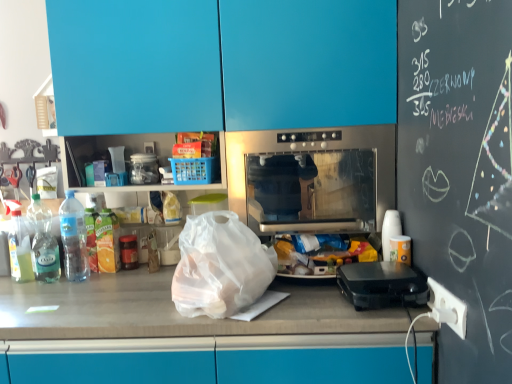
Describe the element at coordinates (20, 249) in the screenshot. This screenshot has height=384, width=512. I see `clear plastic bottle at left, the first bottle in the left-to-right sequence` at that location.

In order to face blue glossy cabinets at upper center, should I rotate leftwards or rightwards?

To align with it, rotate left about 3.722°.

This screenshot has width=512, height=384. Describe the element at coordinates (135, 65) in the screenshot. I see `blue glossy cabinets at upper center` at that location.

I want to click on clear plastic bottle at left, acting as the 2th bottle starting from the left, so click(x=42, y=242).

Is stainless steel oven at center not near clear plastic bottle at left, the 2th bottle when ordered from right to left?

No, there isn't a large distance between stainless steel oven at center and clear plastic bottle at left, the 2th bottle when ordered from right to left.

From the image's perspective, relative to clear plastic bottle at left, the 2th bottle when ordered from right to left, is stainless steel oven at center above or below?

Based on their image positions, stainless steel oven at center is located above clear plastic bottle at left, the 2th bottle when ordered from right to left.

Considering the sizes of stainless steel oven at center and clear plastic bottle at left, acting as the 2th bottle starting from the left, in the image, is stainless steel oven at center bigger or smaller than clear plastic bottle at left, acting as the 2th bottle starting from the left,?

stainless steel oven at center is bigger than clear plastic bottle at left, acting as the 2th bottle starting from the left.

From their relative heights in the image, would you say stainless steel oven at center is taller or shorter than clear plastic bottle at left, the 2th bottle when ordered from right to left?

Clearly, stainless steel oven at center is taller compared to clear plastic bottle at left, the 2th bottle when ordered from right to left.

Which of these two, clear plastic bottle at left, acting as the 3th bottle starting from the right, or translucent plastic bag at center, stands shorter?

With less height is clear plastic bottle at left, acting as the 3th bottle starting from the right.

From a real-world perspective, is clear plastic bottle at left, the first bottle in the left-to-right sequence, positioned above or below translucent plastic bag at center?

clear plastic bottle at left, the first bottle in the left-to-right sequence, is situated lower than translucent plastic bag at center in the real world.

Identify the location of plastic bag located in front of the clear plastic bottle at left, acting as the 3th bottle starting from the right. The image size is (512, 384). (220, 266).

Is clear plastic bottle at left, acting as the 3th bottle starting from the right, aimed at translucent plastic bag at center?

No, clear plastic bottle at left, acting as the 3th bottle starting from the right, is not oriented towards translucent plastic bag at center.

Locate an element on the screen. home appliance located on the right of clear plastic bottle at left, acting as the 2th bottle starting from the left is located at coordinates (312, 178).

Considering the sizes of objects clear plastic bottle at left, acting as the 2th bottle starting from the left, and stainless steel oven at center in the image provided, who is wider, clear plastic bottle at left, acting as the 2th bottle starting from the left, or stainless steel oven at center?

With larger width is stainless steel oven at center.

Do you think clear plastic bottle at left, acting as the 2th bottle starting from the left, is within stainless steel oven at center, or outside of it?

clear plastic bottle at left, acting as the 2th bottle starting from the left, is not enclosed by stainless steel oven at center.

Which object is more forward, clear plastic bottle at left, the 2th bottle when ordered from right to left, or stainless steel oven at center?

stainless steel oven at center is in front.

Measure the distance between clear plastic bottle at left, the 2th bottle when ordered from right to left, and black plastic waffle maker at right.

They are 3.78 feet apart.

How different are the orientations of clear plastic bottle at left, the 2th bottle when ordered from right to left, and black plastic waffle maker at right in degrees?

0.000536 degrees.

Where is `appliance below the clear plastic bottle at left, acting as the 2th bottle starting from the left (from a real-world perspective)`? Image resolution: width=512 pixels, height=384 pixels. appliance below the clear plastic bottle at left, acting as the 2th bottle starting from the left (from a real-world perspective) is located at coordinates (382, 285).

From a real-world perspective, relative to black plastic waffle maker at right, is clear plastic bottle at left, the 2th bottle when ordered from right to left, vertically above or below?

clear plastic bottle at left, the 2th bottle when ordered from right to left, is above black plastic waffle maker at right.

Considering the sizes of objects clear plastic bottle at left, the first bottle in the left-to-right sequence, and blue glossy cabinets at upper center in the image provided, who is shorter, clear plastic bottle at left, the first bottle in the left-to-right sequence, or blue glossy cabinets at upper center?

Standing shorter between the two is clear plastic bottle at left, the first bottle in the left-to-right sequence.

From the picture: How many degrees apart are the facing directions of clear plastic bottle at left, the first bottle in the left-to-right sequence, and blue glossy cabinets at upper center?

The angle between the facing direction of clear plastic bottle at left, the first bottle in the left-to-right sequence, and the facing direction of blue glossy cabinets at upper center is 1.34 degrees.

Is clear plastic bottle at left, the first bottle in the left-to-right sequence, aimed at blue glossy cabinets at upper center?

No, clear plastic bottle at left, the first bottle in the left-to-right sequence, is not turned towards blue glossy cabinets at upper center.

Considering the sizes of objects clear plastic bottle at left, acting as the 3th bottle starting from the right, and blue glossy cabinets at upper center in the image provided, who is bigger, clear plastic bottle at left, acting as the 3th bottle starting from the right, or blue glossy cabinets at upper center?

With larger size is blue glossy cabinets at upper center.

Is black plastic waffle maker at right aimed at stainless steel oven at center?

No.

From a real-world perspective, which is physically above, black plastic waffle maker at right or stainless steel oven at center?

stainless steel oven at center is physically above.

Would you consider black plastic waffle maker at right to be distant from stainless steel oven at center?

No.

Relative to translucent plastic bag at center, is translucent plastic bottle at left, marked as the third bottle in a left-to-right arrangement, in front or behind?

In the image, translucent plastic bottle at left, marked as the third bottle in a left-to-right arrangement, appears behind translucent plastic bag at center.

From a real-world perspective, between translucent plastic bottle at left, which ranks as the first bottle in right-to-left order, and translucent plastic bag at center, who is vertically lower?

translucent plastic bag at center is physically lower.

Considering the relative sizes of translucent plastic bottle at left, which ranks as the first bottle in right-to-left order, and translucent plastic bag at center in the image provided, is translucent plastic bottle at left, which ranks as the first bottle in right-to-left order, wider than translucent plastic bag at center?

In fact, translucent plastic bottle at left, which ranks as the first bottle in right-to-left order, might be narrower than translucent plastic bag at center.

Locate an element on the screen. This screenshot has width=512, height=384. home appliance above the clear plastic bottle at left, the 2th bottle when ordered from right to left (from a real-world perspective) is located at coordinates (312, 178).

You are a GUI agent. You are given a task and a screenshot of the screen. Output one action in this format:
    pyautogui.click(x=<x>, y=<y>)
    Task: Click on the plastic bag that appears in front of the clear plastic bottle at left, acting as the 3th bottle starting from the right
    This screenshot has width=512, height=384.
    Given the screenshot: What is the action you would take?
    pyautogui.click(x=220, y=266)

From the picture: When comparing their distances from blue glossy cabinets at upper center, does clear plastic bottle at left, acting as the 3th bottle starting from the right, or translucent plastic bottle at left, which ranks as the first bottle in right-to-left order, seem further?

clear plastic bottle at left, acting as the 3th bottle starting from the right, is further to blue glossy cabinets at upper center.

From the image, which object appears to be farther from translucent plastic bottle at left, marked as the third bottle in a left-to-right arrangement, clear plastic bottle at left, the 2th bottle when ordered from right to left, or stainless steel oven at center?

stainless steel oven at center is further to translucent plastic bottle at left, marked as the third bottle in a left-to-right arrangement.

Estimate the real-world distances between objects in this image. Which object is closer to translucent plastic bottle at left, which ranks as the first bottle in right-to-left order, black plastic waffle maker at right or clear plastic bottle at left, acting as the 3th bottle starting from the right?

Based on the image, clear plastic bottle at left, acting as the 3th bottle starting from the right, appears to be nearer to translucent plastic bottle at left, which ranks as the first bottle in right-to-left order.

Considering their positions, is clear plastic bottle at left, the 2th bottle when ordered from right to left, positioned closer to translucent plastic bag at center than stainless steel oven at center?

Based on the image, stainless steel oven at center appears to be nearer to translucent plastic bag at center.

Based on their spatial positions, is translucent plastic bottle at left, marked as the third bottle in a left-to-right arrangement, or stainless steel oven at center closer to blue glossy cabinets at upper center?

Based on the image, stainless steel oven at center appears to be nearer to blue glossy cabinets at upper center.

Considering their positions, is translucent plastic bag at center positioned closer to translucent plastic bottle at left, marked as the third bottle in a left-to-right arrangement, than black plastic waffle maker at right?

translucent plastic bag at center is positioned closer to the anchor translucent plastic bottle at left, marked as the third bottle in a left-to-right arrangement.

Estimate the real-world distances between objects in this image. Which object is closer to translucent plastic bottle at left, which ranks as the first bottle in right-to-left order, stainless steel oven at center or translucent plastic bag at center?

translucent plastic bag at center is positioned closer to the anchor translucent plastic bottle at left, which ranks as the first bottle in right-to-left order.

Looking at the image, which one is located further to blue glossy cabinets at upper center, stainless steel oven at center or clear plastic bottle at left, the first bottle in the left-to-right sequence?

clear plastic bottle at left, the first bottle in the left-to-right sequence, is further to blue glossy cabinets at upper center.

Locate an element on the screen. This screenshot has height=384, width=512. cabinetry between clear plastic bottle at left, the first bottle in the left-to-right sequence, and black plastic waffle maker at right, in the horizontal direction is located at coordinates (135, 65).

Locate an element on the screen. Image resolution: width=512 pixels, height=384 pixels. cabinetry between clear plastic bottle at left, acting as the 2th bottle starting from the left, and stainless steel oven at center, in the horizontal direction is located at coordinates (135, 65).

Image resolution: width=512 pixels, height=384 pixels. I want to click on bottle located between clear plastic bottle at left, acting as the 2th bottle starting from the left, and translucent plastic bag at center in the left-right direction, so click(74, 238).

Locate an element on the screen. plastic bag between clear plastic bottle at left, acting as the 2th bottle starting from the left, and black plastic waffle maker at right is located at coordinates (220, 266).